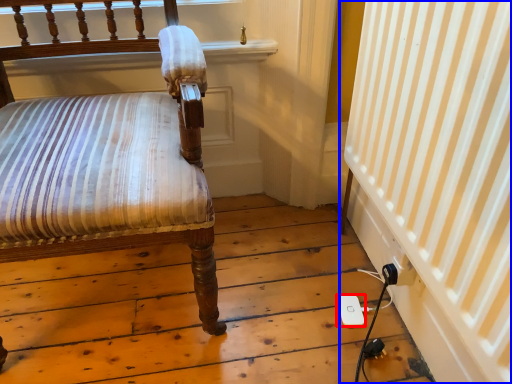
Question: Which object is closer to the camera taking this photo, ipod (highlighted by a red box) or curtain (highlighted by a blue box)?

Choices:
 (A) ipod
 (B) curtain

Answer: (B)